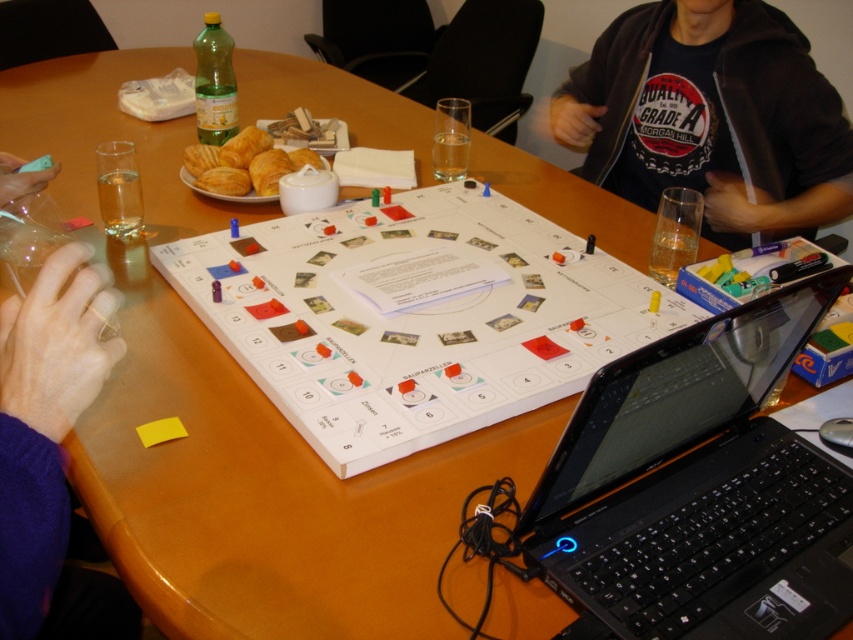
Question: Which of the following is the farthest from the observer?

Choices:
 (A) black plastic laptop at lower right
 (B) purple fabric hand at lower left
 (C) golden flaky croissant at center
 (D) black cotton shirt at upper center

Answer: (D)

Question: Is black plastic laptop at lower right to the left of golden flaky croissant at center from the viewer's perspective?

Choices:
 (A) yes
 (B) no

Answer: (B)

Question: Does black cotton shirt at upper center appear under golden flaky croissant at center?

Choices:
 (A) no
 (B) yes

Answer: (A)

Question: Among these points, which one is nearest to the camera?

Choices:
 (A) (769, 92)
 (B) (42, 385)
 (C) (737, 374)

Answer: (B)

Question: Among these objects, which one is nearest to the camera?

Choices:
 (A) golden flaky croissant at center
 (B) black cotton shirt at upper center

Answer: (A)

Question: Considering the relative positions of black plastic laptop at lower right and golden flaky croissant at center in the image provided, where is black plastic laptop at lower right located with respect to golden flaky croissant at center?

Choices:
 (A) below
 (B) above

Answer: (A)